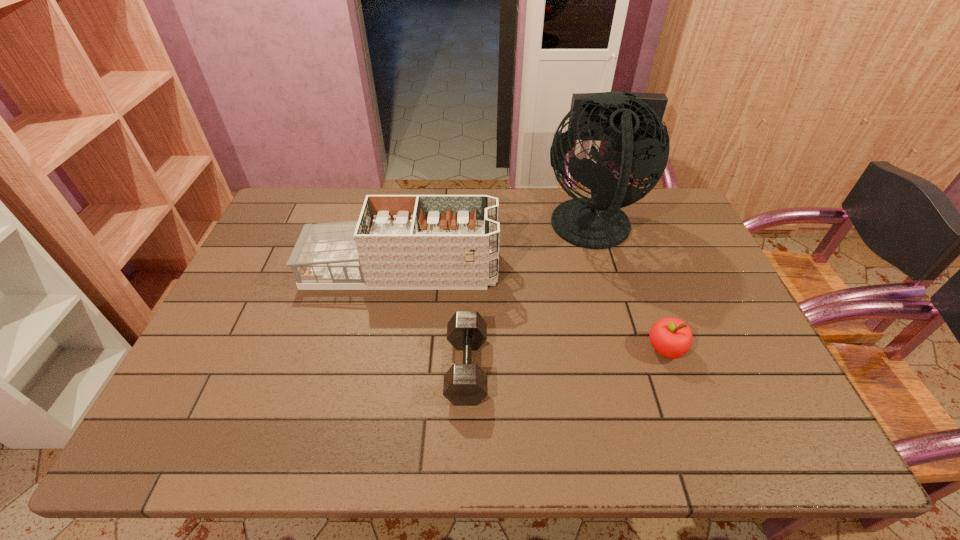
Locate an element on the screen. object that is at the far edge is located at coordinates (634, 129).

Locate an element on the screen. This screenshot has height=540, width=960. vacant space at the far edge of the desktop is located at coordinates (501, 211).

Locate an element on the screen. blank space at the near edge of the desktop is located at coordinates (396, 429).

This screenshot has height=540, width=960. What are the coordinates of `vacant area at the left edge of the desktop` in the screenshot? It's located at (257, 247).

In the image, there is a desktop. At what (x,y) coordinates should I click in order to perform the action: click on vacant space at the right edge. Please return your answer as a coordinate pair (x, y). Looking at the image, I should click on (775, 384).

The width and height of the screenshot is (960, 540). I want to click on vacant area at the far left corner, so click(299, 189).

Image resolution: width=960 pixels, height=540 pixels. Identify the location of vacant space at the far right corner of the desktop. (648, 227).

Locate an element on the screen. Image resolution: width=960 pixels, height=540 pixels. empty space that is in between the third shortest object and the second shortest object is located at coordinates (534, 309).

At what (x,y) coordinates should I click in order to perform the action: click on free space between the third shortest object and the apple. Please return your answer as a coordinate pair (x, y). Looking at the image, I should click on (534, 309).

At what (x,y) coordinates should I click in order to perform the action: click on free space between the second tallest object and the apple. Please return your answer as a coordinate pair (x, y). The image size is (960, 540). Looking at the image, I should click on [534, 309].